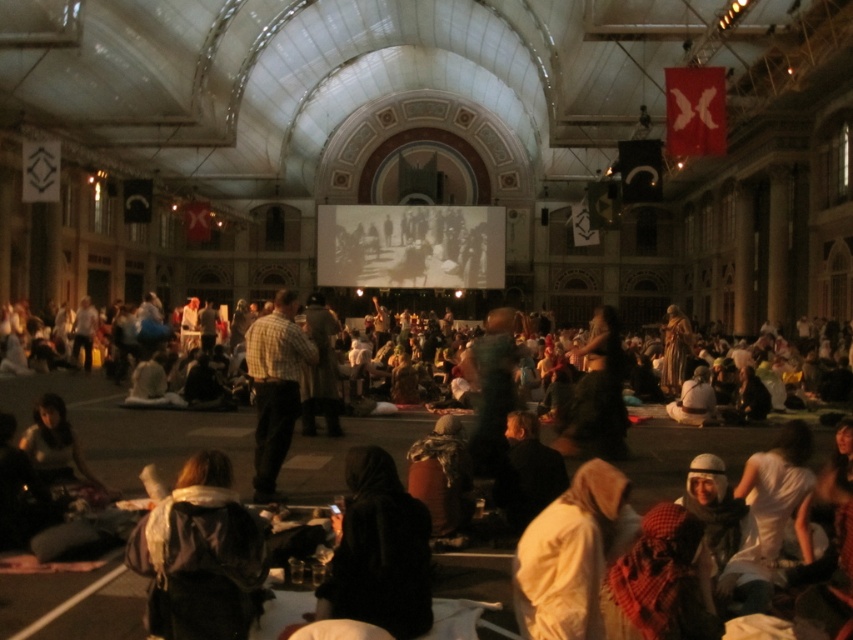
Does dark brown leather jacket at lower left appear over checkered fabric shirt at center?

No, dark brown leather jacket at lower left is not above checkered fabric shirt at center.

Does dark brown leather jacket at lower left appear under checkered fabric shirt at center?

Indeed, dark brown leather jacket at lower left is positioned under checkered fabric shirt at center.

This screenshot has width=853, height=640. I want to click on dark brown leather jacket at lower left, so 200,556.

Which is more to the left, black matte hood at center or checkered fabric shirt at center?

checkered fabric shirt at center is more to the left.

Does black matte hood at center have a greater width compared to checkered fabric shirt at center?

Incorrect, black matte hood at center's width does not surpass checkered fabric shirt at center's.

Is point (347, 472) positioned in front of point (267, 328)?

Yes, point (347, 472) is closer to viewer.

Locate an element on the screen. black matte hood at center is located at coordinates (379, 552).

What do you see at coordinates (379, 552) in the screenshot? I see `black matte hood at center` at bounding box center [379, 552].

Is point (357, 456) behind point (572, 547)?

Yes, it is.

Find the location of a particular element. This screenshot has height=640, width=853. black matte hood at center is located at coordinates (379, 552).